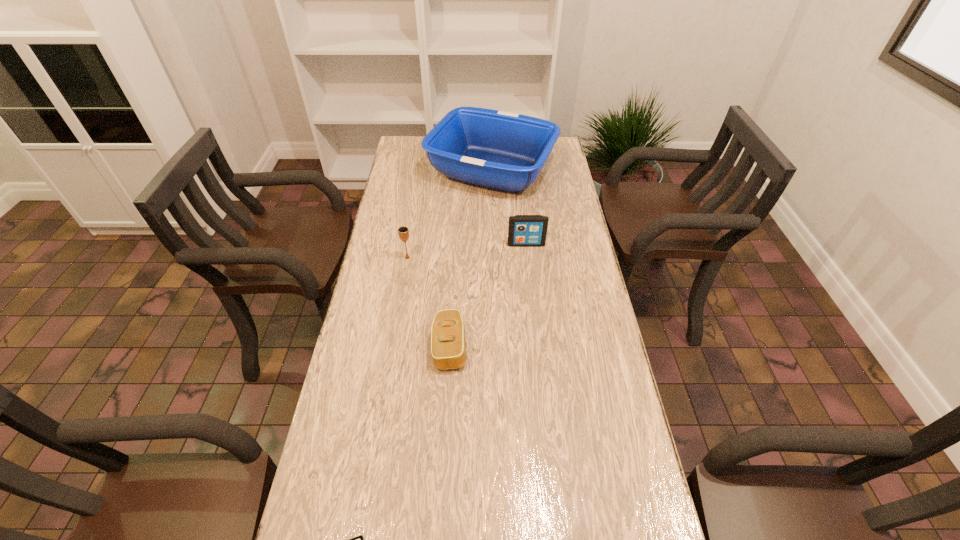
Locate an element on the screen. vacant region at the far left corner of the desktop is located at coordinates (424, 156).

Identify the location of free spot between the third nearest object and the taller iPod. (467, 251).

Locate an element on the screen. The width and height of the screenshot is (960, 540). empty space that is in between the tray and the clutch bag is located at coordinates (470, 259).

At what (x,y) coordinates should I click in order to perform the action: click on free space between the taller iPod and the second nearest object. Please return your answer as a coordinate pair (x, y). The height and width of the screenshot is (540, 960). Looking at the image, I should click on [x=488, y=296].

The image size is (960, 540). Find the location of `vacant area that lies between the right iPod and the chalice`. vacant area that lies between the right iPod and the chalice is located at coordinates (467, 251).

You are a GUI agent. You are given a task and a screenshot of the screen. Output one action in this format:
    pyautogui.click(x=<x>, y=<y>)
    Task: Click on the object that can be found as the fourth closest to the second nearest object
    This screenshot has height=540, width=960.
    Given the screenshot: What is the action you would take?
    pyautogui.click(x=505, y=151)

Identify which object is the second closest to the farther iPod. Please provide its 2D coordinates. Your answer should be formatted as a tuple, i.e. [(x, y)], where the tuple contains the x and y coordinates of a point satisfying the conditions above.

[(403, 231)]

This screenshot has width=960, height=540. In order to click on free space that satisfies the following two spatial constraints: 1. on the front side of the tallest object; 2. on the zipper side of the second nearest object in this screenshot , I will do `click(497, 347)`.

You are a GUI agent. You are given a task and a screenshot of the screen. Output one action in this format:
    pyautogui.click(x=<x>, y=<y>)
    Task: Click on the vacant region that satisfies the following two spatial constraints: 1. on the back side of the third nearest object; 2. on the right side of the tray
    Image resolution: width=960 pixels, height=540 pixels.
    Given the screenshot: What is the action you would take?
    422,170

Locate an element on the screen. The width and height of the screenshot is (960, 540). blank space that satisfies the following two spatial constraints: 1. on the front screen of the taller iPod; 2. on the zipper side of the fourth farthest object is located at coordinates (538, 347).